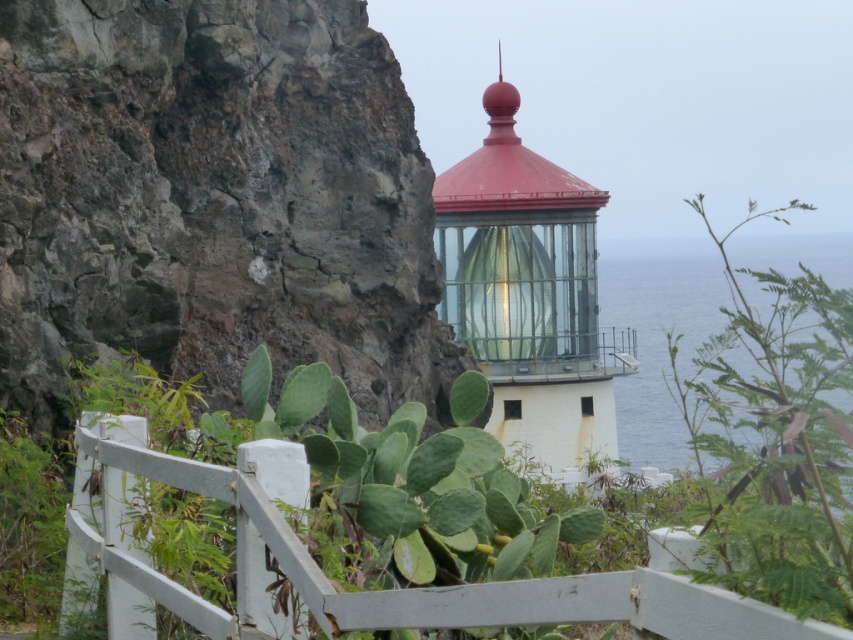
You are a hiker standing at the base of the lighthouse. You see the green leafy plant at upper right and the green leafy cactus at lower left. Which one is closer to you?

The green leafy cactus at lower left is closer to you because it is positioned lower in the image, and the green leafy plant at upper right is farther away.

You are a painter standing in front of the lighthouse scene. You want to paint the white wooden fence at center and the green leafy cactus at lower left. Which object should you look up to paint?

The white wooden fence at center is much taller than the green leafy cactus at lower left, so you should look up to paint the white wooden fence at center.

You are standing at the base of the lighthouse and looking towards the ocean. You notice a green leafy plant at upper right and a white wooden fence at center. Which object is closer to you?

The green leafy plant at upper right is closer to you because the white wooden fence at center is behind it.